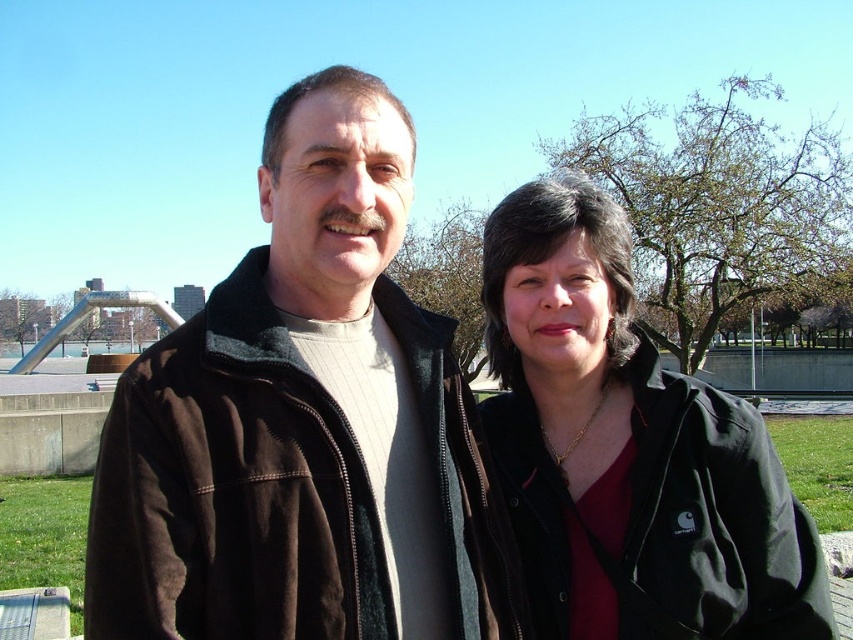
Can you confirm if brown fleece jacket at center is wider than black matte jacket at center?

In fact, brown fleece jacket at center might be narrower than black matte jacket at center.

Does brown fleece jacket at center lie in front of black matte jacket at center?

Yes, it is in front of black matte jacket at center.

Where is `brown fleece jacket at center`? This screenshot has width=853, height=640. brown fleece jacket at center is located at coordinates (302, 422).

Image resolution: width=853 pixels, height=640 pixels. In order to click on brown fleece jacket at center in this screenshot , I will do `click(302, 422)`.